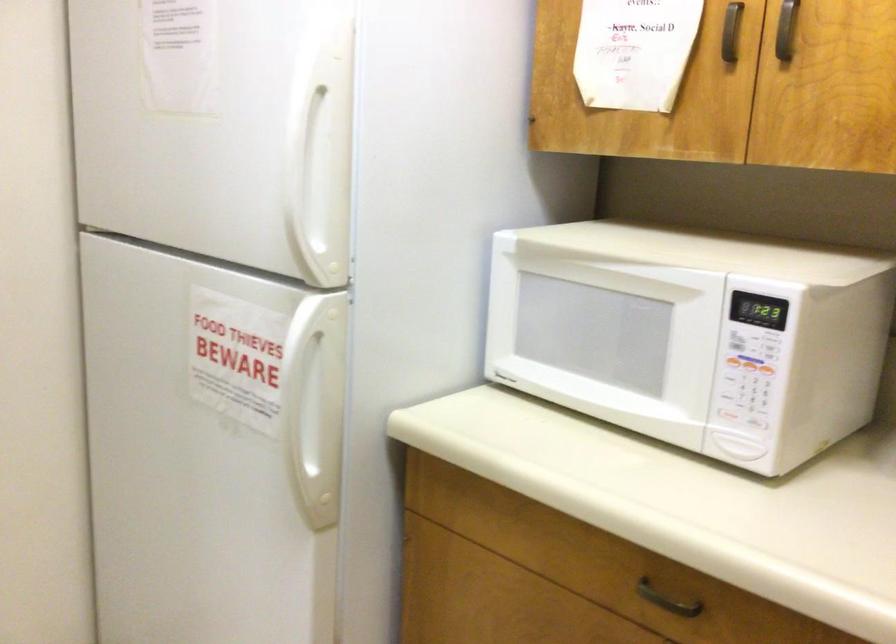
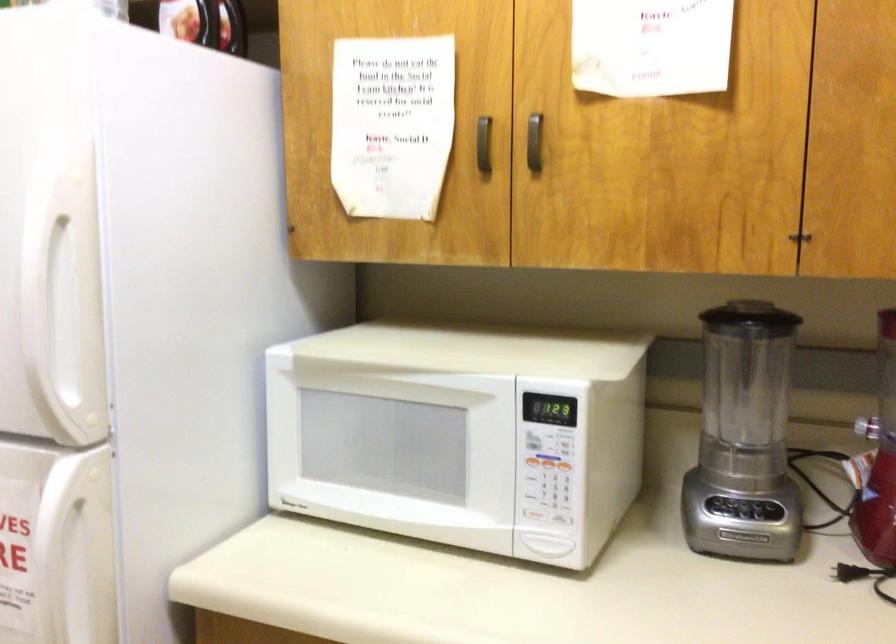
Find the pixel in the second image that matches (316,183) in the first image.

(65, 327)